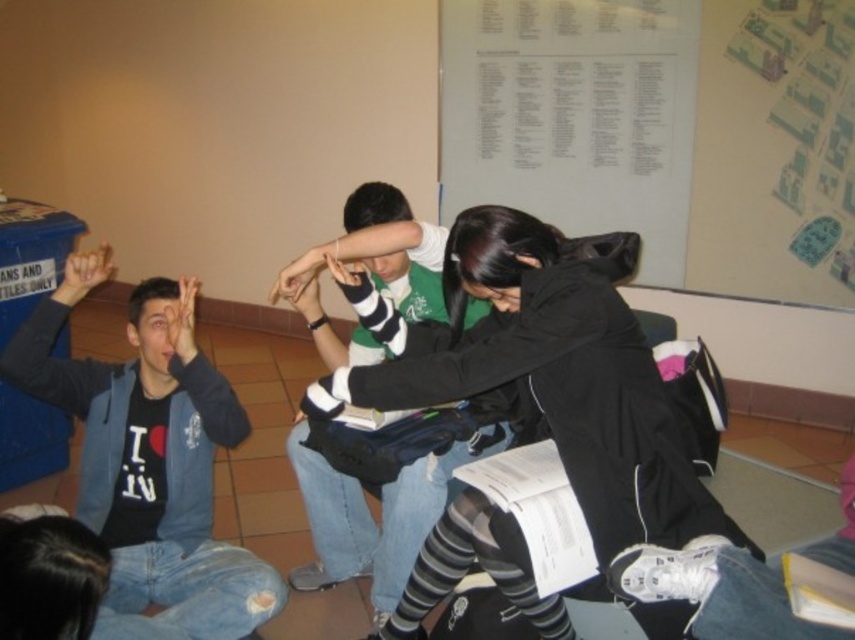
You are standing in the classroom scene and need to place a new poster on the wall. The poster must be placed to the right of the white paper at upper center. Where should you position it?

The white paper at upper center is located at point [665,132]. To place the poster to its right, position it at a coordinate with an x value greater than 0.208 while keeping the y value around 0.779.

You are a photographer standing in the middle of the room. You want to take a picture of the black matte jacket at center and the green jersey at center. How far apart are these two items from each other?

The black matte jacket at center is 35.77 centimeters away from the green jersey at center.